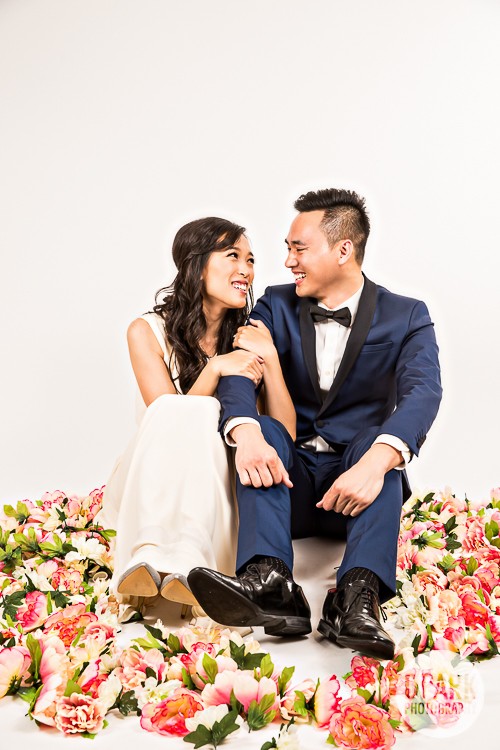
The width and height of the screenshot is (500, 750). What are the coordinates of `backdrop` in the screenshot? It's located at (212, 140).